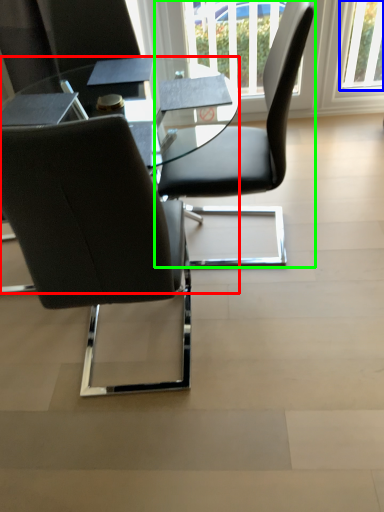
Question: Considering the real-world distances, which object is farthest from table (highlighted by a red box)? window (highlighted by a blue box) or chair (highlighted by a green box)?

Choices:
 (A) window
 (B) chair

Answer: (A)